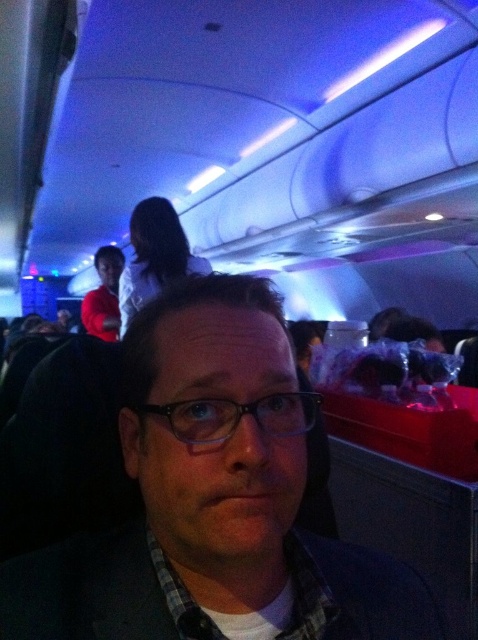
Question: Which point appears closest to the camera in this image?

Choices:
 (A) (212, 429)
 (B) (101, 250)

Answer: (A)

Question: Which point is farther to the camera?

Choices:
 (A) matte black glasses at center
 (B) black plastic glasses at center

Answer: (B)

Question: Can you confirm if matte black glasses at center is positioned to the left of black plastic glasses at center?

Choices:
 (A) yes
 (B) no

Answer: (A)

Question: From the image, what is the correct spatial relationship of matte black glasses at center in relation to black plastic glasses at center?

Choices:
 (A) left
 (B) right

Answer: (A)

Question: Does matte black glasses at center appear over black plastic glasses at center?

Choices:
 (A) no
 (B) yes

Answer: (A)

Question: Which point is closer to the camera taking this photo?

Choices:
 (A) (310, 422)
 (B) (107, 317)
 (C) (215, 436)

Answer: (C)